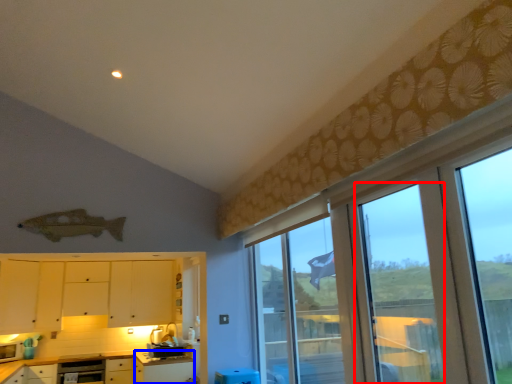
Question: Among these objects, which one is farthest to the camera, screen door (highlighted by a red box) or table (highlighted by a blue box)?

Choices:
 (A) screen door
 (B) table

Answer: (B)